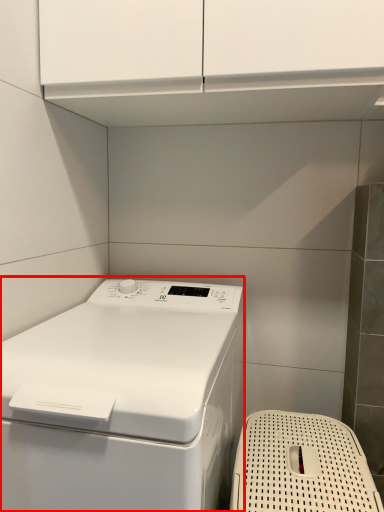
Question: Observing the image, what is the correct spatial positioning of home appliance (annotated by the red box) in reference to dish washer?

Choices:
 (A) right
 (B) left

Answer: (B)